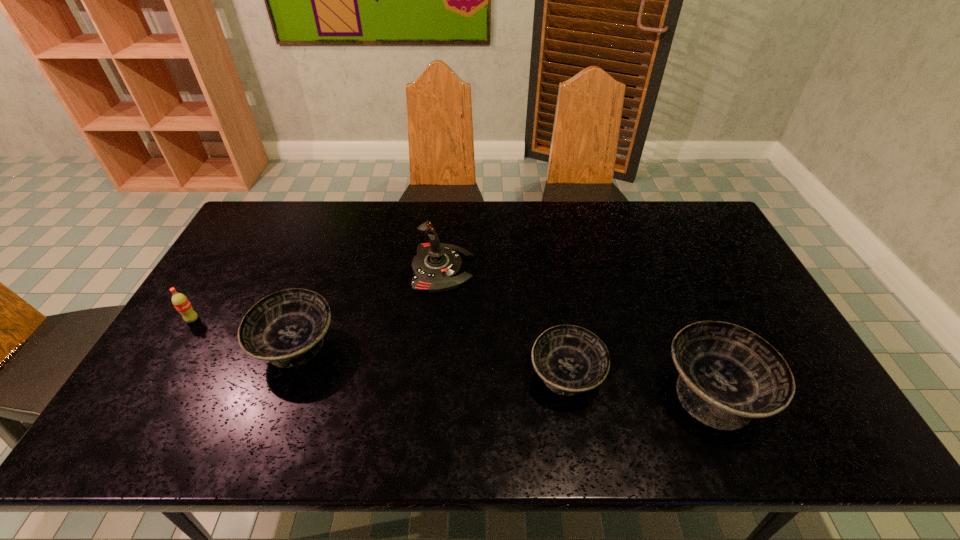
This screenshot has width=960, height=540. What are the coordinates of `the leftmost bowl` in the screenshot? It's located at point(286,328).

Locate an element on the screen. The width and height of the screenshot is (960, 540). the fifth object from right to left is located at coordinates (286, 328).

At what (x,y) coordinates should I click in order to perform the action: click on the second shortest object. Please return your answer as a coordinate pair (x, y). The width and height of the screenshot is (960, 540). Looking at the image, I should click on (570, 359).

The height and width of the screenshot is (540, 960). I want to click on the fourth object from left to right, so click(x=570, y=359).

At what (x,y) coordinates should I click in order to perform the action: click on the rightmost bowl. Please return your answer as a coordinate pair (x, y). Looking at the image, I should click on pyautogui.click(x=728, y=375).

The height and width of the screenshot is (540, 960). Identify the location of the fourth object from right to left. (437, 266).

The image size is (960, 540). Identify the location of joystick. (437, 266).

Find the location of a particular element. This screenshot has height=540, width=960. soda is located at coordinates 180,301.

Locate an element on the screen. sunglasses is located at coordinates (699, 296).

At what (x,y) coordinates should I click in order to perform the action: click on vacant point located 0.370m on the right of the fifth object from right to left. Please return your answer as a coordinate pair (x, y). Looking at the image, I should click on (475, 347).